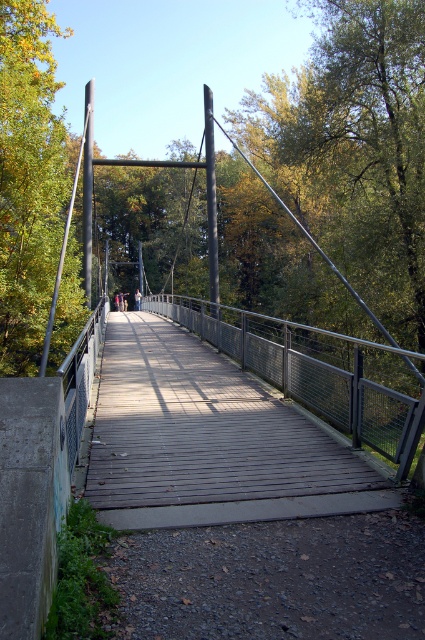
Question: Does wooden planks at center have a larger size compared to wooden bridge at center?

Choices:
 (A) yes
 (B) no

Answer: (B)

Question: Does wooden planks at center appear on the right side of wooden bridge at center?

Choices:
 (A) no
 (B) yes

Answer: (A)

Question: Is wooden planks at center smaller than wooden bridge at center?

Choices:
 (A) yes
 (B) no

Answer: (A)

Question: Which object appears closest to the camera in this image?

Choices:
 (A) wooden bridge at center
 (B) wooden planks at center

Answer: (B)

Question: Among these points, which one is nearest to the camera?

Choices:
 (A) (181, 442)
 (B) (231, 332)

Answer: (A)